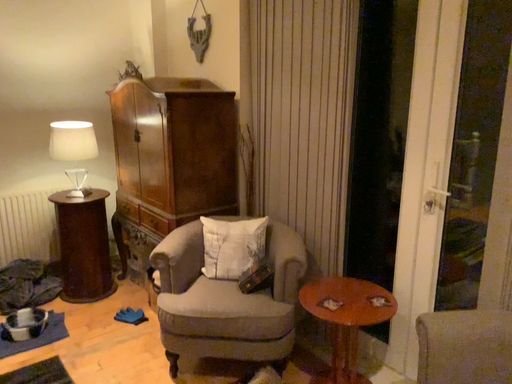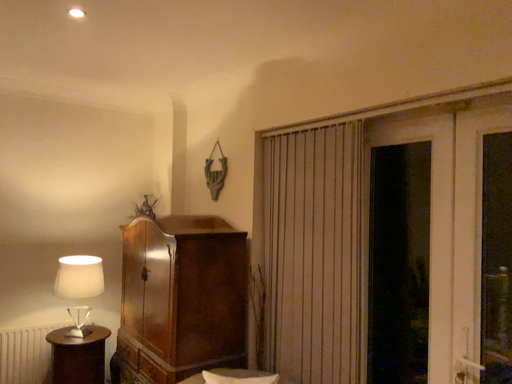
Question: How did the camera likely rotate when shooting the video?

Choices:
 (A) rotated upward
 (B) rotated downward

Answer: (A)